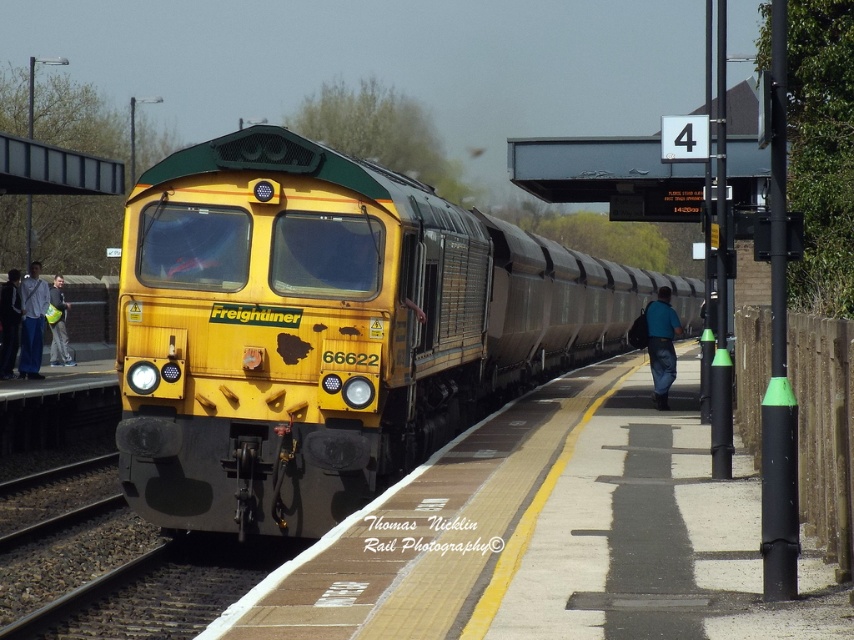
Is denim jacket at left to the left of light gray fabric jacket at left from the viewer's perspective?

No, denim jacket at left is not to the left of light gray fabric jacket at left.

Can you confirm if denim jacket at left is shorter than light gray fabric jacket at left?

Yes, denim jacket at left is shorter than light gray fabric jacket at left.

The image size is (854, 640). What are the coordinates of `denim jacket at left` in the screenshot? It's located at [x=32, y=321].

This screenshot has height=640, width=854. In order to click on denim jacket at left in this screenshot , I will do `click(32, 321)`.

Can you confirm if blue fabric backpack at platform is bigger than denim jacket at left?

Yes, blue fabric backpack at platform is bigger than denim jacket at left.

Does point (661, 294) lie in front of point (44, 305)?

Yes, point (661, 294) is closer to viewer.

Is point (664, 392) positioned before point (25, 344)?

Yes, it is.

Locate an element on the screen. The image size is (854, 640). blue fabric backpack at platform is located at coordinates (661, 344).

Between denim jacket at left and dark blue jeans at left, which one is positioned higher?

Positioned higher is dark blue jeans at left.

Which is in front, point (39, 291) or point (3, 284)?

Positioned in front is point (3, 284).

Identify the location of denim jacket at left. (32, 321).